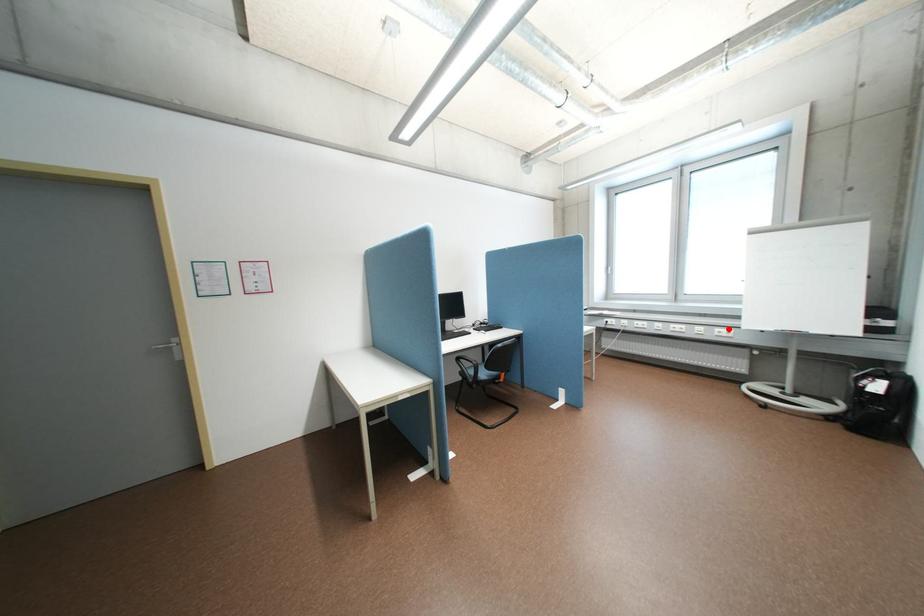
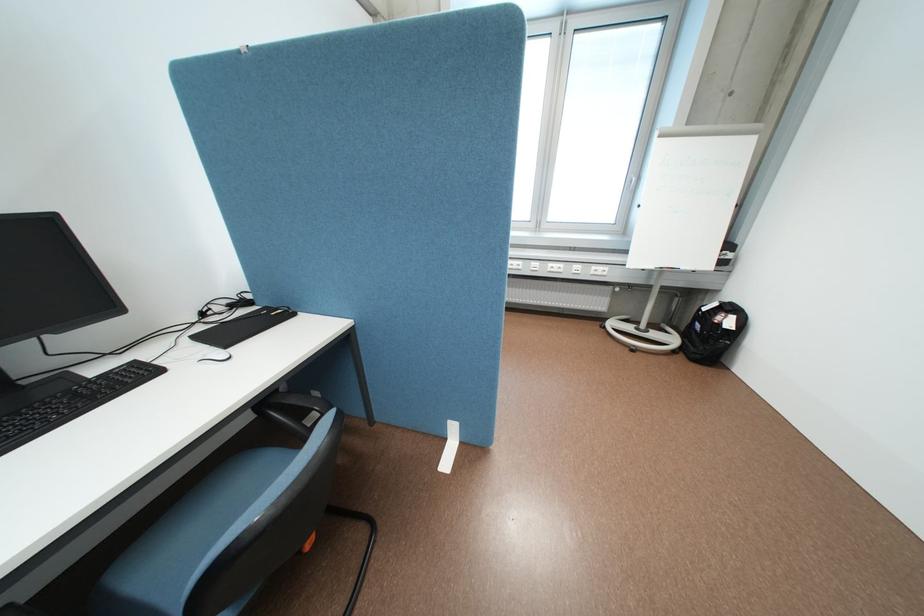
In the second image, find the point that corresponds to the highlighted location in the first image.

(604, 267)